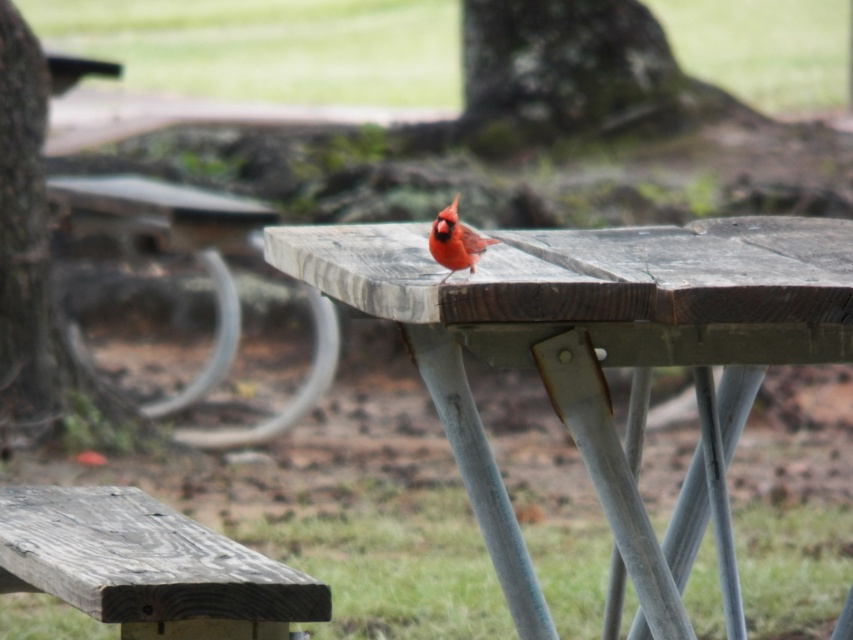
You are standing at the origin point of a coordinate system placed over the image. The origin is at the bottom left corner of the image. The x and y axes increase to the right and upwards respectively. You want to place a new picnic table exactly 0.1 units to the right of the wooden picnic table at center. What coordinate should you use for the new picnic table?

The wooden picnic table at center is located at coordinate point (595, 353). To place a new picnic table exactly 0.1 units to the right, you should add 0.1 to the x coordinate. The new coordinate would be (595, 417).

You are a birdwatcher trying to observe the matte red cardinal at center without disturbing it. You are currently standing next to the weathered wood bench at lower left. Which object is larger in size between the two?

The weathered wood bench at lower left is bigger than the matte red cardinal at center according to the description.